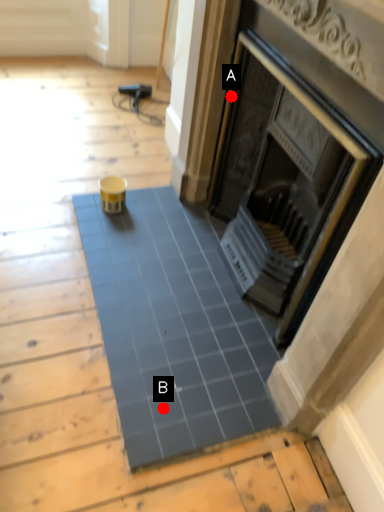
Question: Two points are circled on the image, labeled by A and B beside each circle. Which point is farther from the camera taking this photo?

Choices:
 (A) A is further
 (B) B is further

Answer: (A)